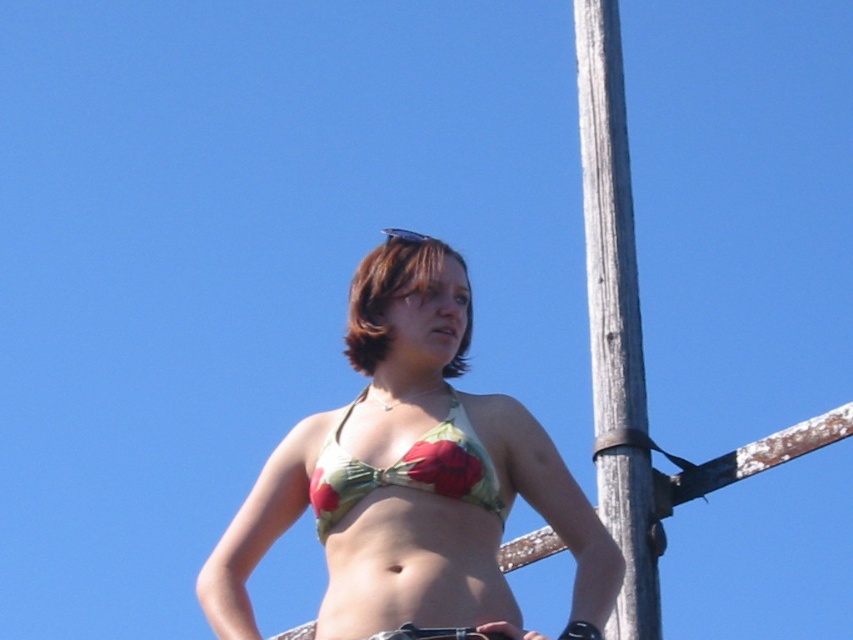
Question: Which object is positioned closest to the floral fabric bikini top at center?

Choices:
 (A) green floral bikini top at center
 (B) transparent plastic goggles at upper center
 (C) wooden pole at right
 (D) brown matte hair at center

Answer: (A)

Question: Can you confirm if green floral bikini top at center is smaller than wooden pole at right?

Choices:
 (A) yes
 (B) no

Answer: (A)

Question: Estimate the real-world distances between objects in this image. Which object is closer to the wooden pole at right?

Choices:
 (A) transparent plastic goggles at upper center
 (B) brown matte hair at center
 (C) green floral bikini top at center
 (D) floral fabric bikini top at center

Answer: (C)

Question: Does brown matte hair at center come in front of transparent plastic goggles at upper center?

Choices:
 (A) no
 (B) yes

Answer: (B)

Question: Which object is positioned farthest from the brown matte hair at center?

Choices:
 (A) transparent plastic goggles at upper center
 (B) wooden pole at right

Answer: (B)

Question: Does green floral bikini top at center appear over brown matte hair at center?

Choices:
 (A) no
 (B) yes

Answer: (A)